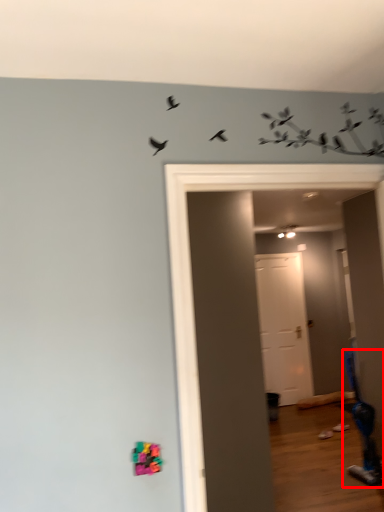
Question: From the image, what is the correct spatial relationship of swivel chair (annotated by the red box) in relation to door?

Choices:
 (A) right
 (B) left

Answer: (A)